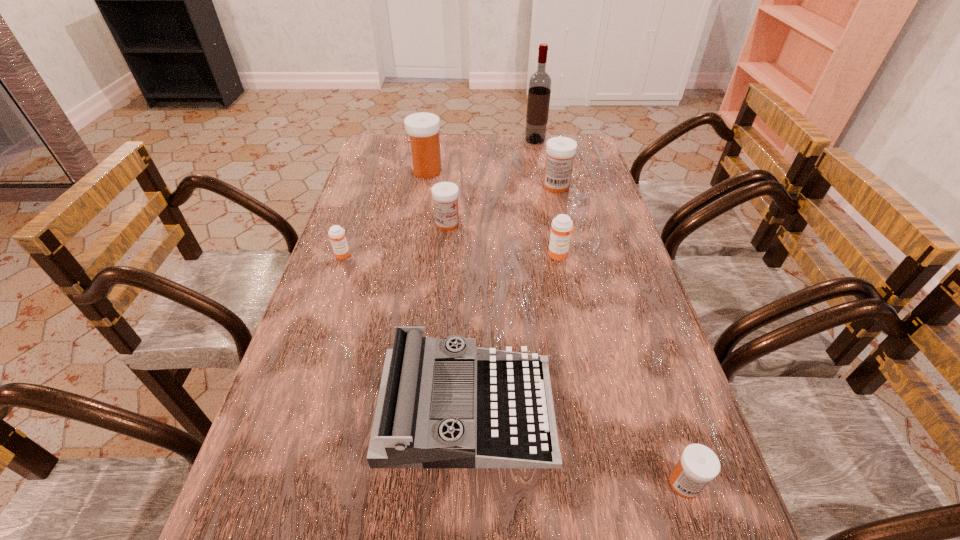
Identify the location of vacant space situated on the front of the smaller orange medicine. This screenshot has height=540, width=960. (314, 342).

The image size is (960, 540). Find the location of `vacant area located 0.360m on the back of the smallest white medicine`. vacant area located 0.360m on the back of the smallest white medicine is located at coordinates (630, 314).

Image resolution: width=960 pixels, height=540 pixels. I want to click on wine bottle that is at the far edge, so click(x=539, y=91).

The image size is (960, 540). What are the coordinates of `medicine located in the far edge section of the desktop` in the screenshot? It's located at (422, 128).

Where is `object present at the left edge`? object present at the left edge is located at coordinates (336, 233).

Identify the location of wine bottle situated at the right edge. (539, 91).

What are the coordinates of `object that is at the far right corner` in the screenshot? It's located at (539, 91).

Locate an element on the screen. This screenshot has height=540, width=960. free spot at the far edge of the desktop is located at coordinates (524, 161).

Find the location of a particular element. This screenshot has height=540, width=960. free space at the left edge of the desktop is located at coordinates (276, 536).

Identify the location of vacant space at the far left corner of the desktop. The width and height of the screenshot is (960, 540). click(380, 160).